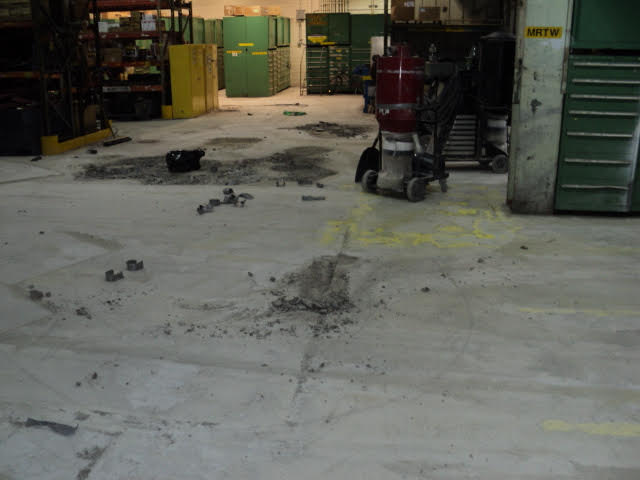
The width and height of the screenshot is (640, 480). Identify the location of shelves. (141, 35), (41, 43).